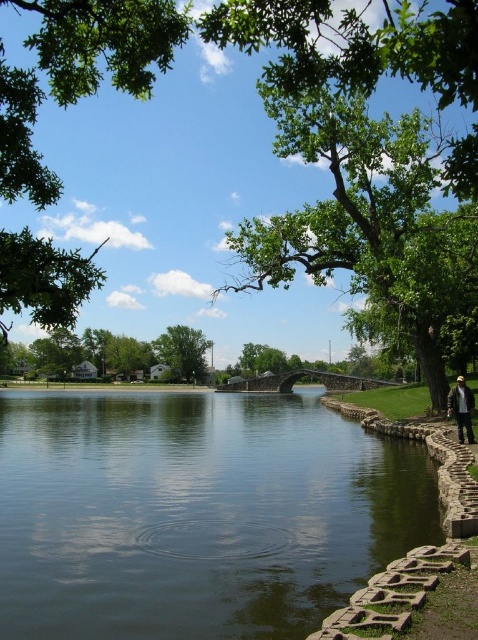
Who is taller, green matte tree at center or camouflage jacket at lower right?

Standing taller between the two is green matte tree at center.

Find the location of `green matte tree at center`. green matte tree at center is located at coordinates (183, 349).

In the scene shown: Does smooth concrete river at center have a greater height compared to camouflage jacket at lower right?

Correct, smooth concrete river at center is much taller as camouflage jacket at lower right.

Who is more forward, (268, 525) or (460, 436)?

Point (268, 525) is more forward.

Identify the location of smooth concrete river at center. (195, 513).

Can you confirm if green leafy tree at center is positioned to the left of green leafy tree at upper left?

In fact, green leafy tree at center is to the right of green leafy tree at upper left.

Does green leafy tree at center have a lesser height compared to green leafy tree at upper left?

Correct, green leafy tree at center is not as tall as green leafy tree at upper left.

Identify the location of green leafy tree at center. This screenshot has height=640, width=478. (370, 228).

At what (x,y) coordinates should I click in order to perform the action: click on green leafy tree at center. Please return your answer as a coordinate pair (x, y). The image size is (478, 640). Looking at the image, I should click on (370, 228).